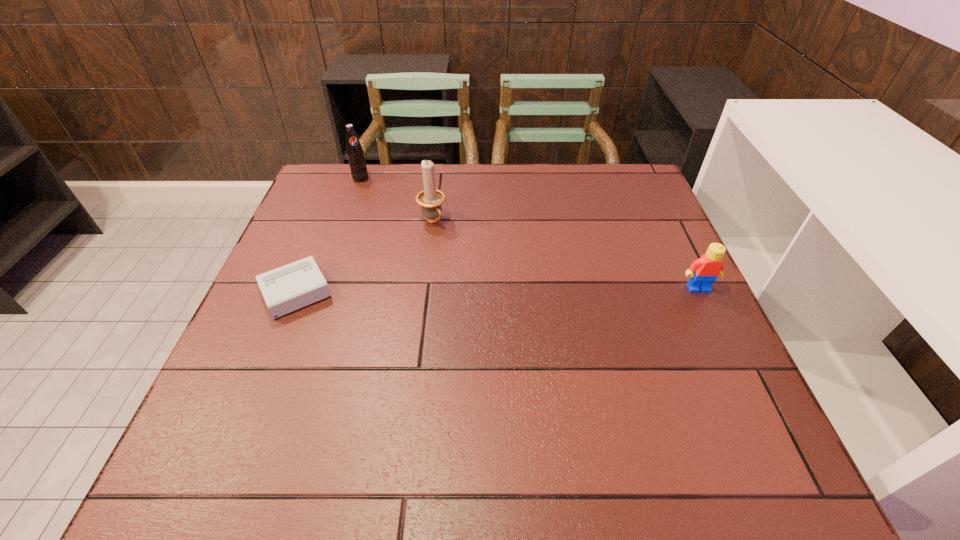
Where is `alarm clock`? alarm clock is located at coordinates (288, 288).

This screenshot has height=540, width=960. In order to click on the second shortest object in this screenshot , I will do `click(703, 272)`.

You are a GUI agent. You are given a task and a screenshot of the screen. Output one action in this format:
    pyautogui.click(x=<x>, y=<y>)
    Task: Click on the Lego
    
    Given the screenshot: What is the action you would take?
    pyautogui.click(x=703, y=272)

Locate an element on the screen. pop is located at coordinates (355, 154).

Locate an element on the screen. The width and height of the screenshot is (960, 540). the third object from left to right is located at coordinates (431, 199).

Image resolution: width=960 pixels, height=540 pixels. Identify the location of candle_holder. (431, 199).

What are the coordinates of `free space located 0.140m on the right of the alarm clock` in the screenshot? It's located at (396, 291).

This screenshot has height=540, width=960. Find the location of `vacant space located on the face of the third tallest object`. vacant space located on the face of the third tallest object is located at coordinates (727, 348).

Identify the location of free space located on the front label of the farthest object. (428, 256).

Find the location of a particular element. This screenshot has width=960, height=540. vacant space located on the front label of the farthest object is located at coordinates (390, 212).